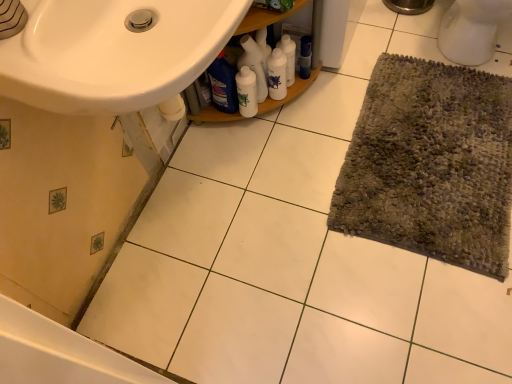
Question: Is white glossy bottles at center aimed at blue glossy bottle at center, the 1th cleaning product positioned from the left?

Choices:
 (A) yes
 (B) no

Answer: (A)

Question: Can you confirm if white glossy bottles at center is bigger than blue glossy bottle at center, positioned as the 4th cleaning product in right-to-left order?

Choices:
 (A) yes
 (B) no

Answer: (A)

Question: Is white glossy bottles at center thinner than blue glossy bottle at center, the 1th cleaning product positioned from the left?

Choices:
 (A) no
 (B) yes

Answer: (A)

Question: Is white glossy bottles at center shorter than blue glossy bottle at center, the 1th cleaning product positioned from the left?

Choices:
 (A) no
 (B) yes

Answer: (A)

Question: Can you confirm if white glossy bottles at center is smaller than blue glossy bottle at center, the 1th cleaning product positioned from the left?

Choices:
 (A) yes
 (B) no

Answer: (B)

Question: Is white glossy bottles at center far away from blue glossy bottle at center, the 1th cleaning product positioned from the left?

Choices:
 (A) no
 (B) yes

Answer: (A)

Question: Does white glossy bottle at center come behind white glossy bottles at center?

Choices:
 (A) no
 (B) yes

Answer: (B)

Question: Would you consider white glossy bottle at center to be distant from white glossy bottles at center?

Choices:
 (A) no
 (B) yes

Answer: (A)

Question: Is white glossy bottle at center bigger than white glossy bottles at center?

Choices:
 (A) yes
 (B) no

Answer: (B)

Question: Does white glossy bottle at center have a lesser width compared to white glossy bottles at center?

Choices:
 (A) yes
 (B) no

Answer: (A)

Question: From the image's perspective, is white glossy bottle at center on white glossy bottles at center?

Choices:
 (A) yes
 (B) no

Answer: (B)

Question: Could you tell me if white glossy bottle at center is turned towards white glossy bottles at center?

Choices:
 (A) yes
 (B) no

Answer: (A)

Question: Considering the relative sizes of blue glossy bottle at center, the 1th cleaning product positioned from the left, and white glossy bottle at center, which ranks as the 3th cleaning product in right-to-left order, in the image provided, is blue glossy bottle at center, the 1th cleaning product positioned from the left, shorter than white glossy bottle at center, which ranks as the 3th cleaning product in right-to-left order,?

Choices:
 (A) no
 (B) yes

Answer: (A)